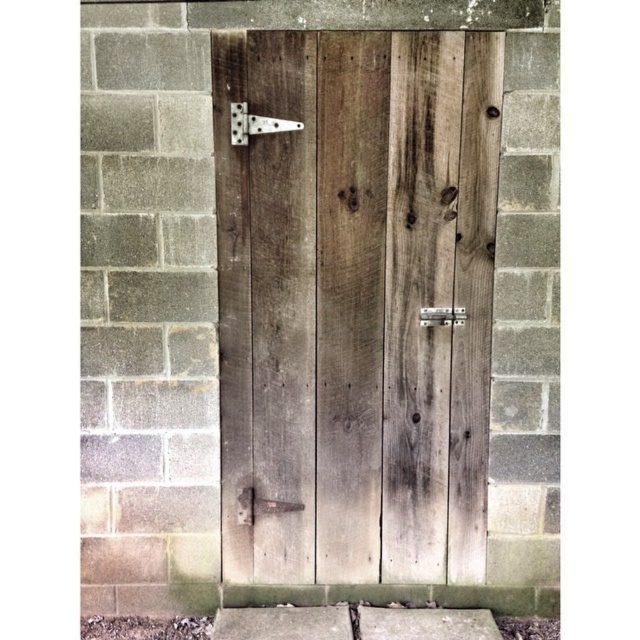
Question: Does matte metal hinge at upper left appear on the left side of rusty metal door handle at lower center?

Choices:
 (A) yes
 (B) no

Answer: (A)

Question: Which of the following is the closest to the observer?

Choices:
 (A) weathered wood door at center
 (B) metallic silver lock at center
 (C) matte metal hinge at upper left
 (D) rusty metal door handle at lower center

Answer: (A)

Question: Which of these objects is positioned farthest from the metallic silver lock at center?

Choices:
 (A) matte metal hinge at upper left
 (B) rusty metal door handle at lower center
 (C) weathered wood door at center

Answer: (B)

Question: Considering the relative positions of weathered wood door at center and rusty metal door handle at lower center in the image provided, where is weathered wood door at center located with respect to rusty metal door handle at lower center?

Choices:
 (A) above
 (B) below

Answer: (A)

Question: Is the position of matte metal hinge at upper left more distant than that of metallic silver lock at center?

Choices:
 (A) yes
 (B) no

Answer: (B)

Question: Estimate the real-world distances between objects in this image. Which object is farther from the weathered wood door at center?

Choices:
 (A) matte metal hinge at upper left
 (B) metallic silver lock at center
 (C) rusty metal door handle at lower center

Answer: (C)